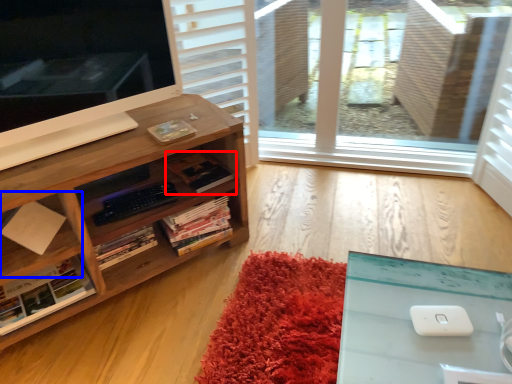
Question: Which object is further to the camera taking this photo, book (highlighted by a red box) or shelf (highlighted by a blue box)?

Choices:
 (A) book
 (B) shelf

Answer: (A)